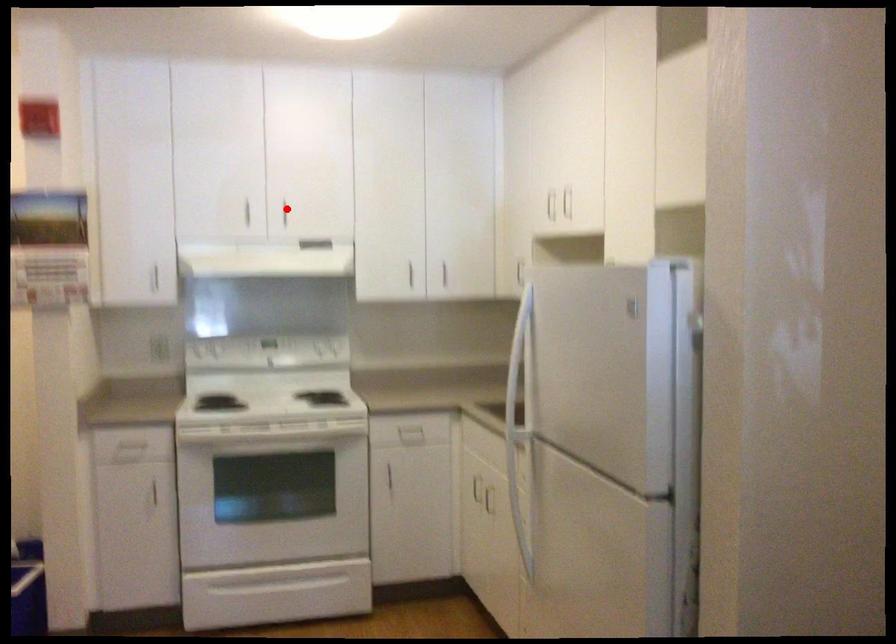
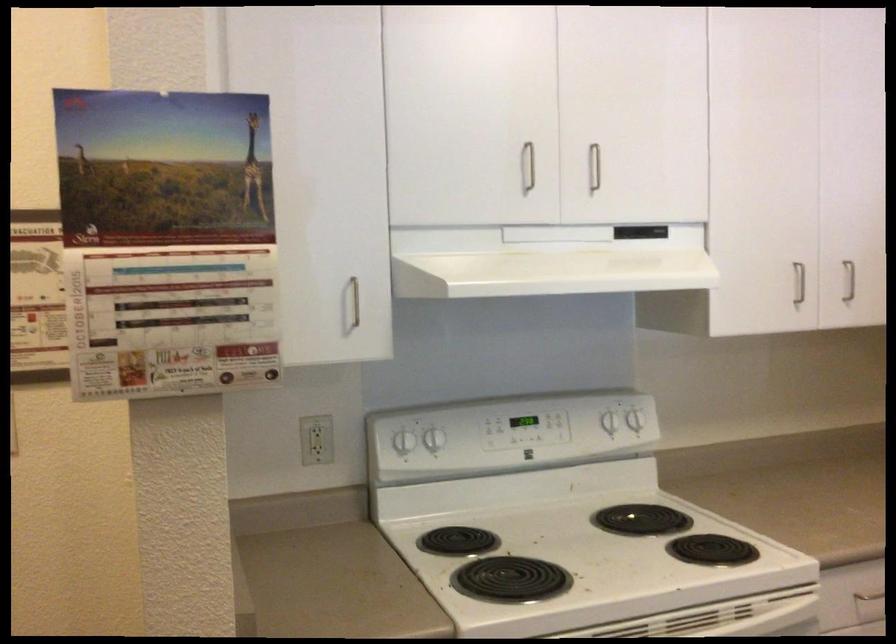
Question: A red point is marked in image1. In image2, is the corresponding 3D point closer to the camera or farther? Reply with the corresponding letter.

Choices:
 (A) The corresponding 3D point is closer.
 (B) The corresponding 3D point is farther.

Answer: (A)